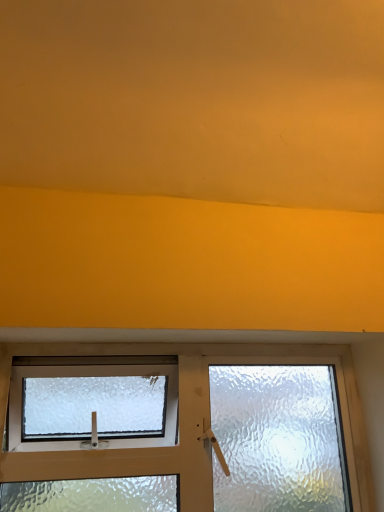
Describe the element at coordinates (187, 417) in the screenshot. I see `frosted glass door at bottom` at that location.

The image size is (384, 512). In order to click on frosted glass door at bottom in this screenshot , I will do `click(187, 417)`.

Locate an element on the screen. The height and width of the screenshot is (512, 384). frosted glass door at bottom is located at coordinates (187, 417).